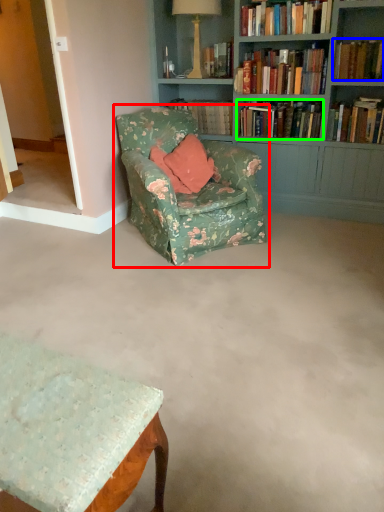
Question: Which object is the closest to the chair (highlighted by a red box)? Choose among these: book (highlighted by a blue box) or book (highlighted by a green box).

Choices:
 (A) book
 (B) book

Answer: (B)